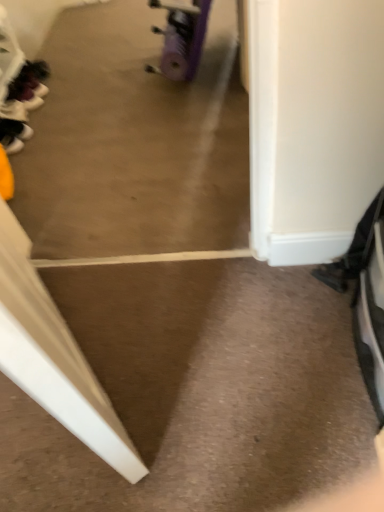
Question: Considering the relative sizes of black matte shoe at left, which is counted as the 2th footwear, starting from the top, and purple rubber wheel at center in the image provided, is black matte shoe at left, which is counted as the 2th footwear, starting from the top, shorter than purple rubber wheel at center?

Choices:
 (A) yes
 (B) no

Answer: (A)

Question: Is black matte shoe at left, the 2th footwear positioned from the back, turned away from purple rubber wheel at center?

Choices:
 (A) no
 (B) yes

Answer: (A)

Question: From the image's perspective, does black matte shoe at left, placed as the first footwear when sorted from front to back, appear lower than purple rubber wheel at center?

Choices:
 (A) yes
 (B) no

Answer: (A)

Question: Is black matte shoe at left, placed as the first footwear when sorted from front to back, to the right of purple rubber wheel at center from the viewer's perspective?

Choices:
 (A) no
 (B) yes

Answer: (A)

Question: Is purple rubber wheel at center completely or partially inside black matte shoe at left, which is counted as the 2th footwear, starting from the top?

Choices:
 (A) no
 (B) yes

Answer: (A)

Question: Considering the relative sizes of black matte shoe at left, the 2th footwear positioned from the back, and purple rubber wheel at center in the image provided, is black matte shoe at left, the 2th footwear positioned from the back, bigger than purple rubber wheel at center?

Choices:
 (A) yes
 (B) no

Answer: (B)

Question: Is black matte shoe at left, placed as the first footwear when sorted from front to back, behind matte black shoe at left, which appears as the second footwear when ordered from the bottom?

Choices:
 (A) no
 (B) yes

Answer: (A)

Question: Considering the relative positions of black matte shoe at left, the 2th footwear positioned from the back, and matte black shoe at left, the first footwear viewed from the top, in the image provided, is black matte shoe at left, the 2th footwear positioned from the back, to the left of matte black shoe at left, the first footwear viewed from the top, from the viewer's perspective?

Choices:
 (A) no
 (B) yes

Answer: (A)

Question: Is black matte shoe at left, the 1th footwear in the bottom-to-top sequence, outside matte black shoe at left, the first footwear viewed from the top?

Choices:
 (A) yes
 (B) no

Answer: (A)

Question: Considering the relative sizes of black matte shoe at left, placed as the first footwear when sorted from front to back, and matte black shoe at left, the first footwear when ordered from back to front, in the image provided, is black matte shoe at left, placed as the first footwear when sorted from front to back, thinner than matte black shoe at left, the first footwear when ordered from back to front,?

Choices:
 (A) no
 (B) yes

Answer: (B)

Question: Could you tell me if black matte shoe at left, the 1th footwear in the bottom-to-top sequence, is facing matte black shoe at left, the first footwear when ordered from back to front?

Choices:
 (A) no
 (B) yes

Answer: (A)

Question: From the image's perspective, is black matte shoe at left, the 1th footwear in the bottom-to-top sequence, below matte black shoe at left, the first footwear when ordered from back to front?

Choices:
 (A) no
 (B) yes

Answer: (B)

Question: Is purple rubber wheel at center completely or partially inside matte black shoe at left, the first footwear when ordered from back to front?

Choices:
 (A) yes
 (B) no

Answer: (B)